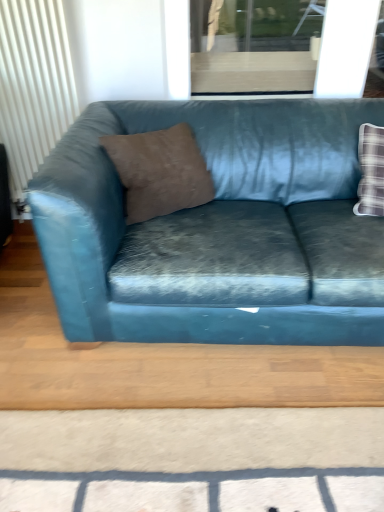
Question: From the image's perspective, does teal velvet couch at center appear lower than white textured radiator at left?

Choices:
 (A) yes
 (B) no

Answer: (A)

Question: From a real-world perspective, is teal velvet couch at center located beneath white textured radiator at left?

Choices:
 (A) no
 (B) yes

Answer: (B)

Question: Is teal velvet couch at center not inside white textured radiator at left?

Choices:
 (A) no
 (B) yes

Answer: (B)

Question: Does teal velvet couch at center have a greater height compared to white textured radiator at left?

Choices:
 (A) yes
 (B) no

Answer: (B)

Question: Is teal velvet couch at center looking in the opposite direction of white textured radiator at left?

Choices:
 (A) yes
 (B) no

Answer: (B)

Question: From the image's perspective, is teal velvet couch at center above or below white textured radiator at left?

Choices:
 (A) below
 (B) above

Answer: (A)

Question: Is teal velvet couch at center in front of or behind white textured radiator at left in the image?

Choices:
 (A) front
 (B) behind

Answer: (A)

Question: From a real-world perspective, is teal velvet couch at center above or below white textured radiator at left?

Choices:
 (A) above
 (B) below

Answer: (B)

Question: Looking at the image, does teal velvet couch at center seem bigger or smaller compared to white textured radiator at left?

Choices:
 (A) big
 (B) small

Answer: (A)

Question: Is transparent glass window at upper center in front of or behind brown suede pillow at center in the image?

Choices:
 (A) behind
 (B) front

Answer: (A)

Question: Looking at the image, does transparent glass window at upper center seem bigger or smaller compared to brown suede pillow at center?

Choices:
 (A) big
 (B) small

Answer: (B)

Question: Considering the positions of transparent glass window at upper center and brown suede pillow at center in the image, is transparent glass window at upper center taller or shorter than brown suede pillow at center?

Choices:
 (A) short
 (B) tall

Answer: (B)

Question: Considering the relative positions of transparent glass window at upper center and brown suede pillow at center in the image provided, is transparent glass window at upper center to the left or to the right of brown suede pillow at center?

Choices:
 (A) left
 (B) right

Answer: (B)

Question: Is white textured radiator at left wider or thinner than transparent glass window at upper center?

Choices:
 (A) wide
 (B) thin

Answer: (A)

Question: Based on their sizes in the image, would you say white textured radiator at left is bigger or smaller than transparent glass window at upper center?

Choices:
 (A) big
 (B) small

Answer: (A)